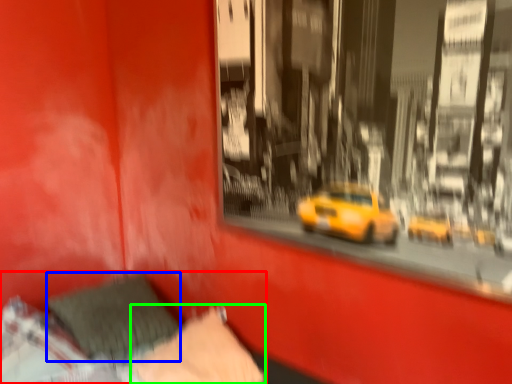
Question: Which is nearer to the bed (highlighted by a red box)? pillow (highlighted by a blue box) or pillow (highlighted by a green box).

Choices:
 (A) pillow
 (B) pillow

Answer: (A)